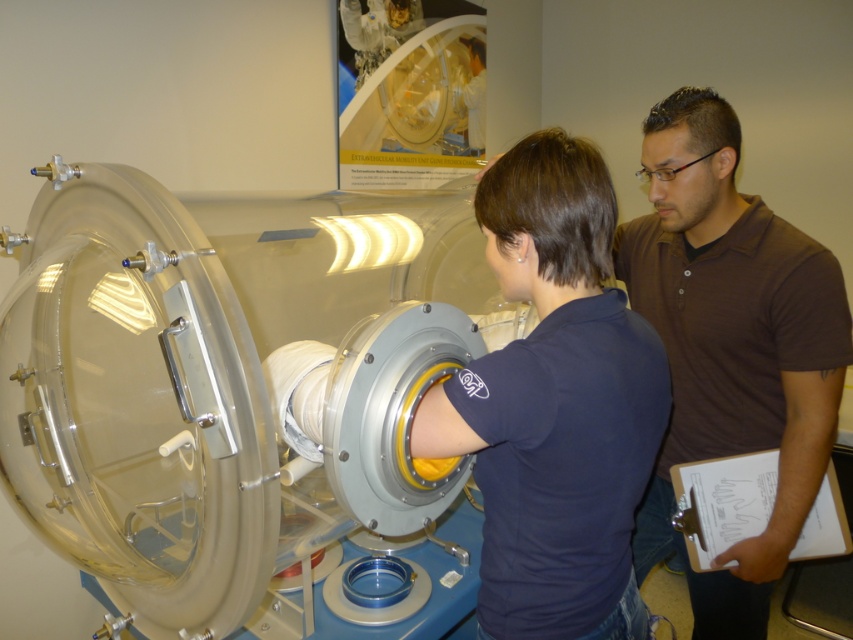
You are a technician who needs to access the control panel located behind the transparent plastic cylinder at center. The brown smooth shirt at center is blocking your path. Can you move around the cylinder to reach the control panel?

The transparent plastic cylinder at center is in front of the brown smooth shirt at center, meaning the cylinder is closer to you. Since the cylinder is transparent, you can see around it to locate the control panel behind. However, the brown smooth shirt at center is behind the cylinder, so you can move around the cylinder to reach the control panel without obstruction.

You are a technician standing at the origin point in the image. You need to move to the transparent plastic cylinder at center. Which direction should you move in? Please provide your answer in terms of coordinates relative to the origin point.

The transparent plastic cylinder at center is located at coordinates point (x=238, y=394), so you should move towards the right and slightly downward from the origin point to reach it.